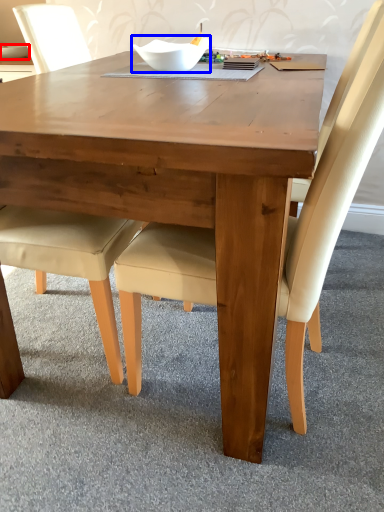
Question: Which object is further to the camera taking this photo, glass bowl (highlighted by a red box) or bowl (highlighted by a blue box)?

Choices:
 (A) glass bowl
 (B) bowl

Answer: (A)